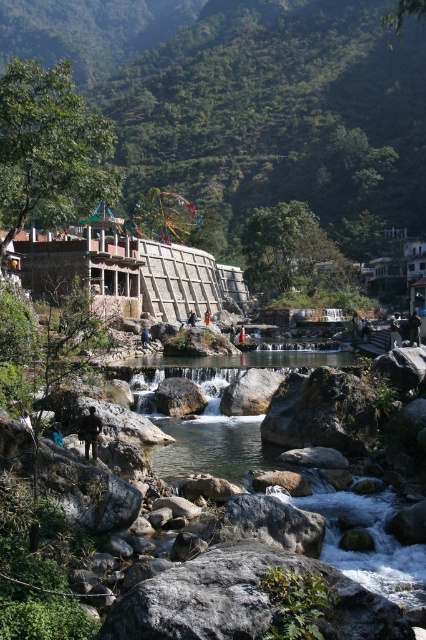
Question: Does dark gray fabric person at center appear on the left side of blue fabric person at center?

Choices:
 (A) yes
 (B) no

Answer: (B)

Question: Which point appears closest to the camera in this image?

Choices:
 (A) (419, 584)
 (B) (331, 186)
 (C) (101, 426)

Answer: (A)

Question: Which point is closer to the camera taking this photo?

Choices:
 (A) (89, 442)
 (B) (313, 140)
 (C) (368, 561)
 (D) (146, 342)

Answer: (C)

Question: Can you confirm if dark gray fabric person at center is positioned to the left of blue fabric person at center?

Choices:
 (A) no
 (B) yes

Answer: (A)

Question: Which point is closer to the camera taking this photo?

Choices:
 (A) (92, 413)
 (B) (146, 332)
 (C) (356, 513)
 (D) (66, 54)

Answer: (C)

Question: Considering the relative positions of dark gray fabric person at center and blue fabric person at center in the image provided, where is dark gray fabric person at center located with respect to blue fabric person at center?

Choices:
 (A) right
 (B) left

Answer: (A)